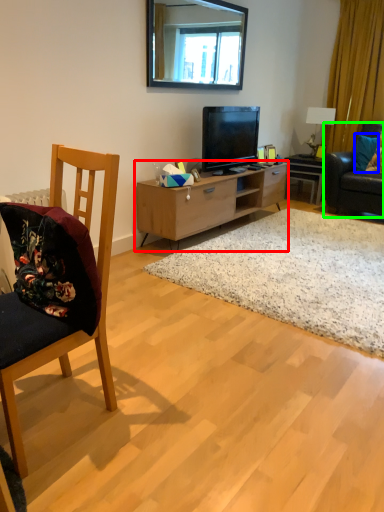
Question: Estimate the real-world distances between objects in this image. Which object is farther from cabinetry (highlighted by a red box), pillow (highlighted by a blue box) or studio couch (highlighted by a green box)?

Choices:
 (A) pillow
 (B) studio couch

Answer: (A)